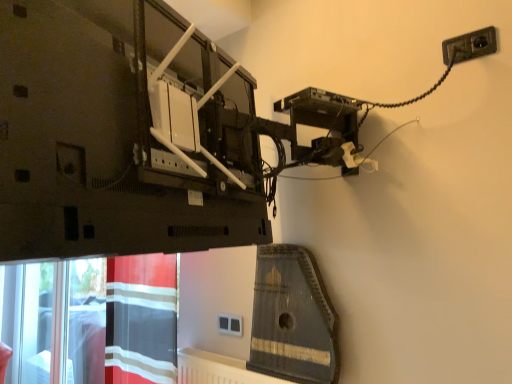
Question: Based on their positions, is white plastic socket at center located to the left or right of wooden harp at center?

Choices:
 (A) right
 (B) left

Answer: (B)

Question: From the image's perspective, is white plastic socket at center located above or below wooden harp at center?

Choices:
 (A) below
 (B) above

Answer: (A)

Question: Which is farther from the red striped fabric at lower left?

Choices:
 (A) wooden harp at center
 (B) black plastic socket at upper right
 (C) white plastic socket at center

Answer: (B)

Question: Estimate the real-world distances between objects in this image. Which object is closer to the red striped fabric at lower left?

Choices:
 (A) wooden harp at center
 (B) black plastic socket at upper right
 (C) white plastic socket at center

Answer: (C)